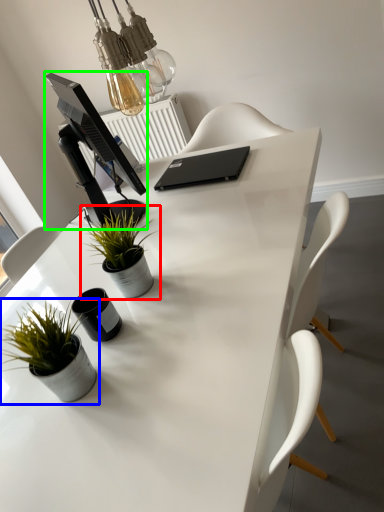
Question: Which object is positioned farthest from houseplant (highlighted by a red box)? Select from houseplant (highlighted by a blue box) and computer monitor (highlighted by a green box).

Choices:
 (A) houseplant
 (B) computer monitor

Answer: (A)